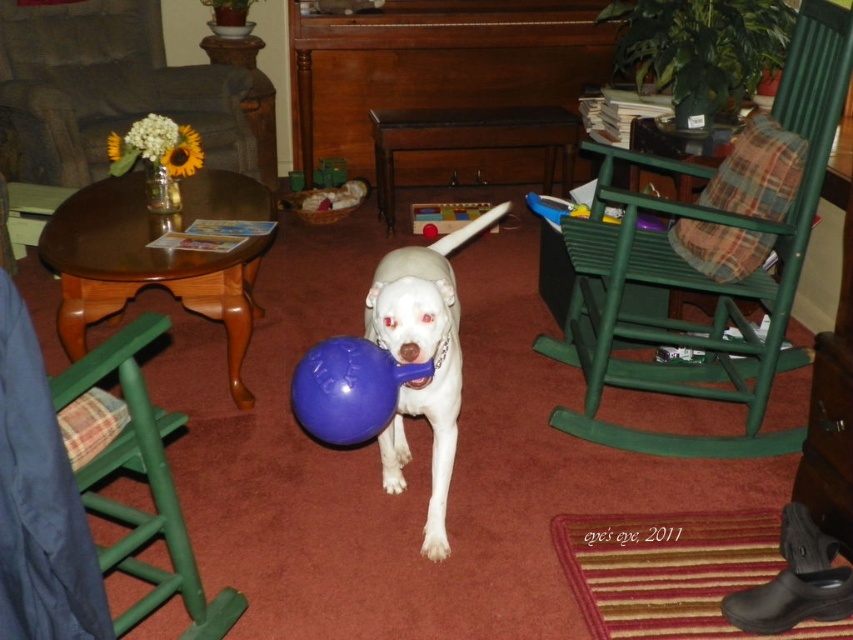
From the picture: Between green wood rocking chair at center right and rubber blue ball at center, which one is positioned higher?

green wood rocking chair at center right is higher up.

Is point (801, 442) closer to viewer compared to point (328, 353)?

That is False.

The image size is (853, 640). What are the coordinates of `green wood rocking chair at center right` in the screenshot? It's located at (699, 275).

Does green wood rocking chair at lower left appear on the right side of rubber blue ball at center?

In fact, green wood rocking chair at lower left is to the left of rubber blue ball at center.

Does green wood rocking chair at lower left appear over rubber blue ball at center?

No.

Does point (102, 497) lie in front of point (352, 349)?

No, it is behind (352, 349).

At what (x,y) coordinates should I click in order to perform the action: click on green wood rocking chair at lower left. Please return your answer as a coordinate pair (x, y). Image resolution: width=853 pixels, height=640 pixels. Looking at the image, I should click on (83, 496).

Is green wood rocking chair at lower left in front of white glossy dog at center?

Yes, it is in front of white glossy dog at center.

Does green wood rocking chair at lower left have a greater height compared to white glossy dog at center?

Incorrect, green wood rocking chair at lower left's height is not larger of white glossy dog at center's.

Does point (199, 637) lie in front of point (453, 323)?

Yes, it is in front of point (453, 323).

I want to click on green wood rocking chair at lower left, so click(83, 496).